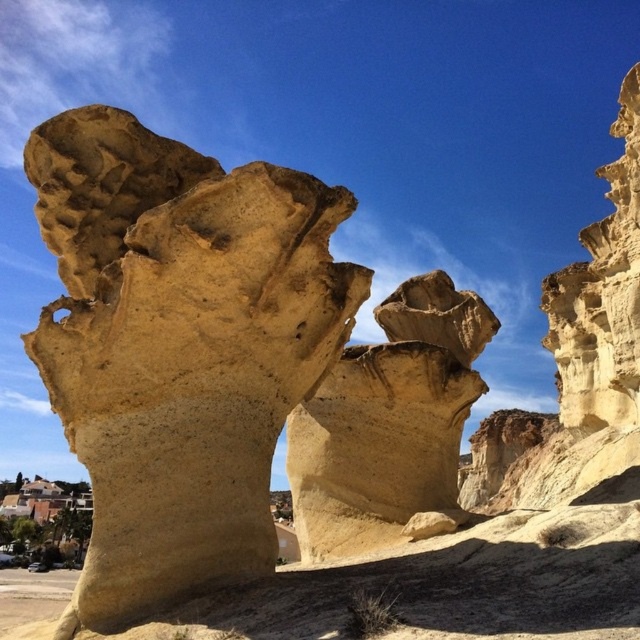
Question: Is sandstone rock formation at center smaller than smooth beige rock at center?

Choices:
 (A) yes
 (B) no

Answer: (A)

Question: Which of the following is the farthest from the observer?

Choices:
 (A) sandstone rock formation at center
 (B) smooth beige rock at center

Answer: (B)

Question: Can you confirm if sandstone rock formation at center is bigger than smooth beige rock at center?

Choices:
 (A) no
 (B) yes

Answer: (A)

Question: Does sandstone rock formation at center have a greater width compared to smooth beige rock at center?

Choices:
 (A) yes
 (B) no

Answer: (A)

Question: Which point appears farthest from the camera in this image?

Choices:
 (A) (211, 164)
 (B) (330, 385)

Answer: (B)